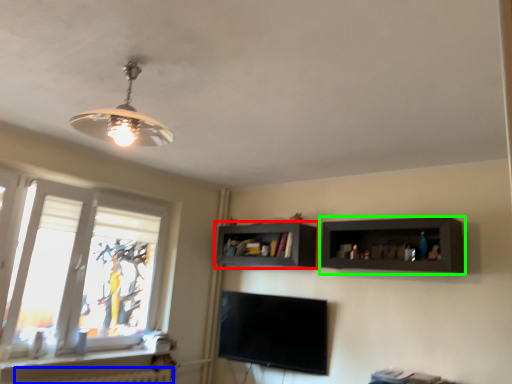
Question: Which is farther away from shelf (highlighted by a red box)? radiator (highlighted by a blue box) or shelf (highlighted by a green box)?

Choices:
 (A) radiator
 (B) shelf

Answer: (A)